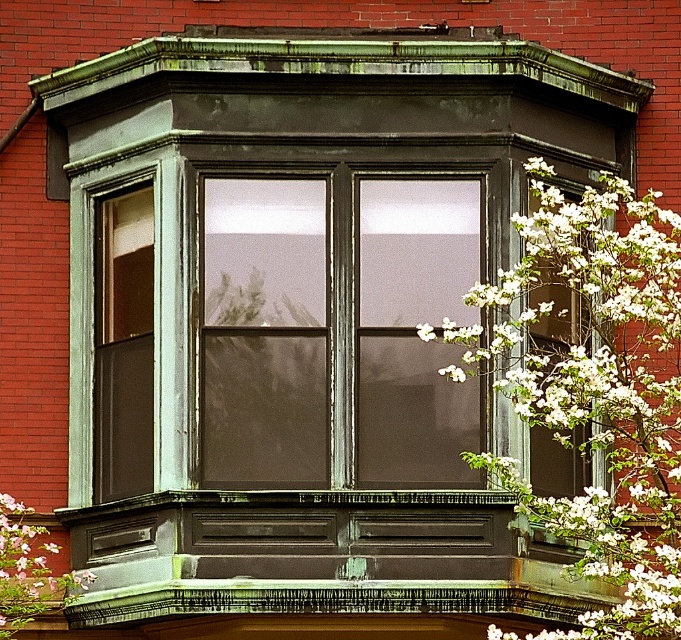
Question: Which point appears closest to the camera in this image?

Choices:
 (A) (617, 257)
 (B) (311, 308)

Answer: (A)

Question: Considering the relative positions of matte glass window at center and white blossoms at right in the image provided, where is matte glass window at center located with respect to white blossoms at right?

Choices:
 (A) below
 (B) above

Answer: (B)

Question: Which of the following is the farthest from the observer?

Choices:
 (A) white blossoms at right
 (B) white blossoms at upper right
 (C) matte glass window at center

Answer: (C)

Question: Which point is closer to the camera taking this photo?

Choices:
 (A) coord(674,352)
 (B) coord(426,413)
 (C) coord(31,570)

Answer: (B)

Question: Is matte glass window at center above white blossoms at right?

Choices:
 (A) yes
 (B) no

Answer: (A)

Question: Is matte glass window at center in front of white blossoms at right?

Choices:
 (A) no
 (B) yes

Answer: (A)